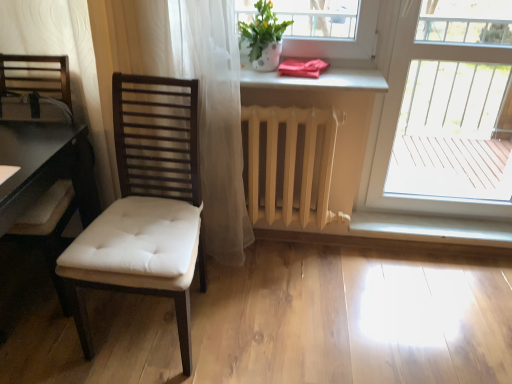
The height and width of the screenshot is (384, 512). In order to click on white matte radiator at center in this screenshot , I will do `click(292, 160)`.

Image resolution: width=512 pixels, height=384 pixels. Find the location of `matte white pot at upper center`. matte white pot at upper center is located at coordinates (263, 37).

Where is `matte white cushioned chair at left`? This screenshot has width=512, height=384. matte white cushioned chair at left is located at coordinates (151, 189).

At what (x,y) coordinates should I click in order to perform the action: click on transparent glass door at right. Please return your answer as a coordinate pair (x, y). This screenshot has width=512, height=384. Looking at the image, I should click on (445, 109).

This screenshot has height=384, width=512. I want to click on white matte radiator at center, so click(292, 160).

Is matte white pot at upper center at the back of white glossy window sill at lower center?

No, white glossy window sill at lower center's orientation is not away from matte white pot at upper center.

Is there a large distance between white glossy window sill at lower center and matte white pot at upper center?

Indeed, white glossy window sill at lower center is not near matte white pot at upper center.

Where is `houseplant that appears on the left of white glossy window sill at lower center`? This screenshot has width=512, height=384. houseplant that appears on the left of white glossy window sill at lower center is located at coordinates (263, 37).

Is matte white pot at upper center behind white glossy window sill at lower center?

No, matte white pot at upper center is in front of white glossy window sill at lower center.

What's the angular difference between matte white pot at upper center and white glossy window sill at lower center's facing directions?

1.71 degrees.

From a real-world perspective, between matte white pot at upper center and white glossy window sill at lower center, who is vertically higher?

matte white pot at upper center is physically above.

Are matte white pot at upper center and white glossy window sill at lower center far apart?

Yes, matte white pot at upper center and white glossy window sill at lower center are quite far apart.

Considering the points (421, 234) and (288, 69), which point is behind, point (421, 234) or point (288, 69)?

The point (421, 234) is more distant.

Is white glossy window sill at lower center thinner than red satin towel at upper center?

Yes.

There is a white glossy window sill at lower center. Where is `towel/napkin above it (from a real-world perspective)`? towel/napkin above it (from a real-world perspective) is located at coordinates (302, 68).

Is white glossy window sill at lower center to the left of red satin towel at upper center from the viewer's perspective?

In fact, white glossy window sill at lower center is to the right of red satin towel at upper center.

Looking at this image, is the surface of white matte radiator at center in direct contact with white glossy window sill at lower center?

No, white matte radiator at center is not beside white glossy window sill at lower center.

Is white matte radiator at center not within white glossy window sill at lower center?

white matte radiator at center is positioned outside white glossy window sill at lower center.

In the image, there is a white glossy window sill at lower center. At what (x,y) coordinates should I click in order to perform the action: click on radiator above it (from the image's perspective). Please return your answer as a coordinate pair (x, y). Looking at the image, I should click on click(292, 160).

Which of these two, white matte radiator at center or white glossy window sill at lower center, stands shorter?

With less height is white glossy window sill at lower center.

Identify the location of towel/napkin in front of the white glossy window sill at lower center. The image size is (512, 384). (302, 68).

Can you tell me how much red satin towel at upper center and white glossy window sill at lower center differ in facing direction?

They differ by 1.71 degrees in their facing directions.

In terms of width, does red satin towel at upper center look wider or thinner when compared to white glossy window sill at lower center?

red satin towel at upper center is wider than white glossy window sill at lower center.

Considering the relative positions of red satin towel at upper center and white glossy window sill at lower center in the image provided, is red satin towel at upper center to the right of white glossy window sill at lower center from the viewer's perspective?

No, red satin towel at upper center is not to the right of white glossy window sill at lower center.

This screenshot has height=384, width=512. Identify the location of window sill behind the white matte radiator at center. (431, 229).

From the image's perspective, does white glossy window sill at lower center appear lower than white matte radiator at center?

→ Yes.

Who is shorter, white glossy window sill at lower center or white matte radiator at center?

Standing shorter between the two is white glossy window sill at lower center.

Is white glossy window sill at lower center located outside white matte radiator at center?

That's correct, white glossy window sill at lower center is outside of white matte radiator at center.

Is point (292, 178) closer or farther from the camera than point (435, 186)?

Point (292, 178) is closer to the camera than point (435, 186).

Would you say white matte radiator at center is outside transparent glass door at right?

white matte radiator at center is positioned outside transparent glass door at right.

In the scene shown: Is white matte radiator at center wider than transparent glass door at right?

Yes.

Considering the positions of objects white matte radiator at center and transparent glass door at right in the image provided, who is in front, white matte radiator at center or transparent glass door at right?

transparent glass door at right.

Where is `window sill below the matte white pot at upper center (from the image's perspective)`? The width and height of the screenshot is (512, 384). window sill below the matte white pot at upper center (from the image's perspective) is located at coordinates (431, 229).

This screenshot has height=384, width=512. In order to click on houseplant in front of the white glossy window sill at lower center in this screenshot , I will do `click(263, 37)`.

Looking at the image, which one is located closer to matte white cushioned chair at left, white matte radiator at center or red satin towel at upper center?

white matte radiator at center is positioned closer to the anchor matte white cushioned chair at left.

Considering their positions, is red satin towel at upper center positioned closer to matte white pot at upper center than matte white cushioned chair at left?

red satin towel at upper center is positioned closer to the anchor matte white pot at upper center.

Considering their positions, is red satin towel at upper center positioned further to matte white cushioned chair at left than matte white pot at upper center?

red satin towel at upper center is positioned further to the anchor matte white cushioned chair at left.

When comparing their distances from red satin towel at upper center, does transparent glass door at right or matte white cushioned chair at left seem closer?

matte white cushioned chair at left is closer to red satin towel at upper center.

Looking at the image, which one is located closer to white glossy window sill at lower center, transparent glass door at right or white matte radiator at center?

white matte radiator at center.

Estimate the real-world distances between objects in this image. Which object is closer to white glossy window sill at lower center, white matte radiator at center or red satin towel at upper center?

Among the two, white matte radiator at center is located nearer to white glossy window sill at lower center.

Based on their spatial positions, is transparent glass door at right or red satin towel at upper center closer to matte white cushioned chair at left?

red satin towel at upper center is positioned closer to the anchor matte white cushioned chair at left.

Considering their positions, is transparent glass door at right positioned closer to matte white cushioned chair at left than white glossy window sill at lower center?

white glossy window sill at lower center is closer to matte white cushioned chair at left.

Find the location of a particular element. Image resolution: width=512 pixels, height=384 pixels. window sill between red satin towel at upper center and transparent glass door at right is located at coordinates (431, 229).

Locate an element on the screen. This screenshot has height=384, width=512. window sill situated between matte white pot at upper center and transparent glass door at right from left to right is located at coordinates (431, 229).

Where is `towel/napkin located between white matte radiator at center and white glossy window sill at lower center in the left-right direction`? towel/napkin located between white matte radiator at center and white glossy window sill at lower center in the left-right direction is located at coordinates (302, 68).

Find the location of `houseplant between matte white cushioned chair at left and transparent glass door at right`. houseplant between matte white cushioned chair at left and transparent glass door at right is located at coordinates (263, 37).